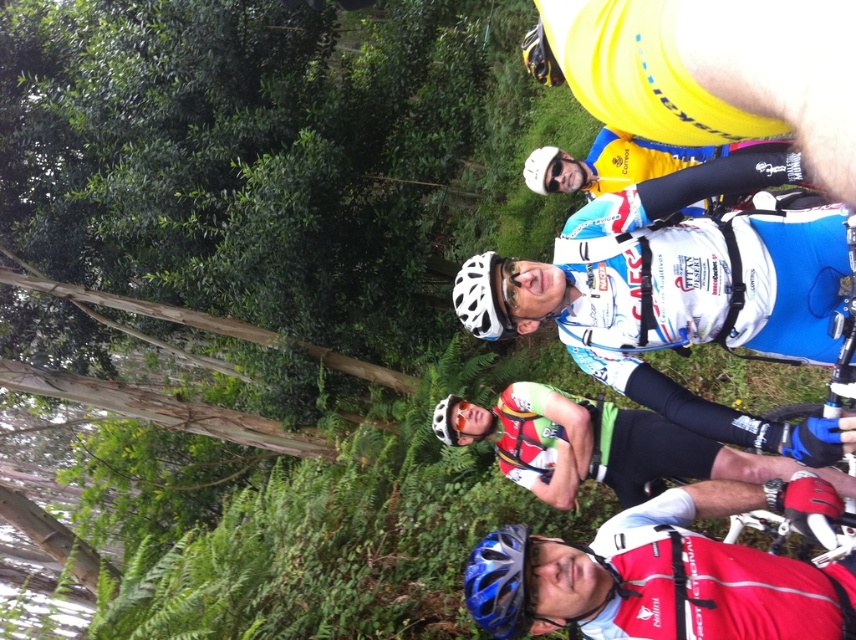
Question: Can you confirm if green leafy tree at upper left is positioned to the left of blue matte helmet at lower center?

Choices:
 (A) yes
 (B) no

Answer: (A)

Question: Is white matte bicycle helmet at center closer to camera compared to white matte goggles at center?

Choices:
 (A) no
 (B) yes

Answer: (A)

Question: Considering the real-world distances, which object is closest to the red matte helmet at center?

Choices:
 (A) blue matte helmet at lower center
 (B) white matte bicycle helmet at center

Answer: (A)

Question: Which point appears farthest from the camera in this image?

Choices:
 (A) (471, 257)
 (B) (474, 609)

Answer: (A)

Question: Among these points, which one is nearest to the camera?

Choices:
 (A) (317, 140)
 (B) (720, 460)
 (C) (467, 284)

Answer: (C)

Question: Is blue matte helmet at lower center to the left of white matte goggles at center from the viewer's perspective?

Choices:
 (A) no
 (B) yes

Answer: (B)